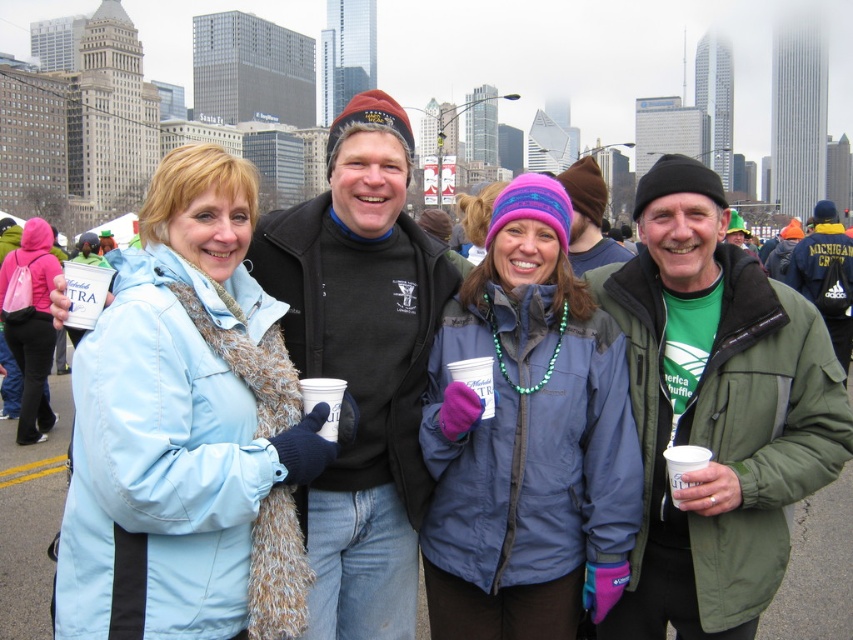
Is point (527, 244) closer to camera compared to point (363, 262)?

Yes, it is in front of point (363, 262).

Locate an element on the screen. This screenshot has width=853, height=640. blue nylon jacket at center is located at coordinates (527, 440).

Can you confirm if black fleece jacket at center is positioned to the left of green fabric jacket at right?

Correct, you'll find black fleece jacket at center to the left of green fabric jacket at right.

Who is shorter, black fleece jacket at center or green fabric jacket at right?

green fabric jacket at right

What do you see at coordinates (361, 364) in the screenshot? I see `black fleece jacket at center` at bounding box center [361, 364].

Locate an element on the screen. black fleece jacket at center is located at coordinates (361, 364).

Which of these two, pink fabric backpack at left or white paper cup at center, stands shorter?

white paper cup at center is shorter.

Is point (22, 298) behind point (337, 406)?

Yes, it is behind point (337, 406).

Locate an element on the screen. The height and width of the screenshot is (640, 853). pink fabric backpack at left is located at coordinates [30, 324].